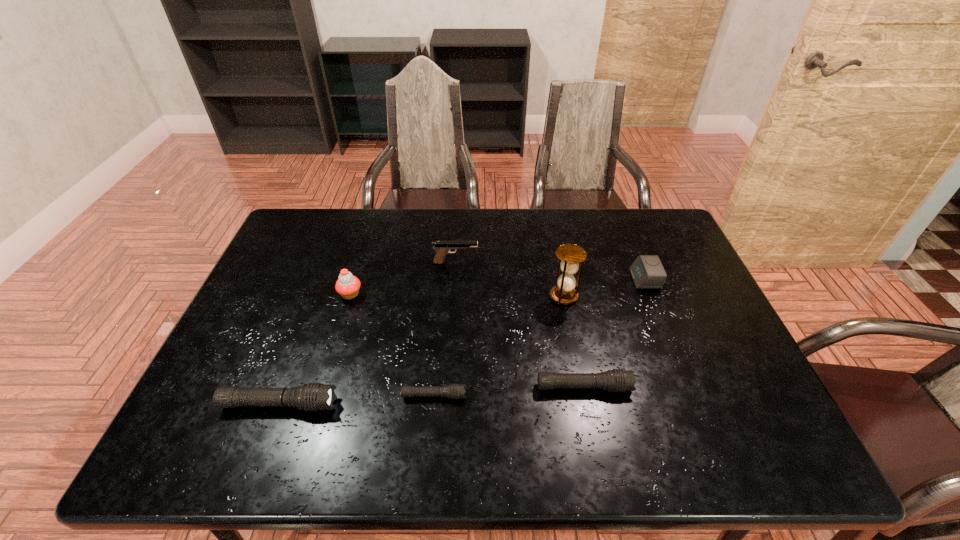
This screenshot has width=960, height=540. I want to click on the leftmost flashlight, so click(x=313, y=396).

Identify the location of the second flashlight from left to right. (454, 391).

Image resolution: width=960 pixels, height=540 pixels. I want to click on the shortest flashlight, so click(x=454, y=391).

Where is `the second tallest flashlight`? The width and height of the screenshot is (960, 540). the second tallest flashlight is located at coordinates (617, 380).

Where is `the rightmost flashlight`? The width and height of the screenshot is (960, 540). the rightmost flashlight is located at coordinates (617, 380).

The image size is (960, 540). What are the coordinates of `the farthest object` in the screenshot? It's located at point(442,248).

Where is `the rightmost object`? This screenshot has height=540, width=960. the rightmost object is located at coordinates (647, 272).

At what (x,y) coordinates should I click in order to perform the action: click on cupcake. Please return your answer as a coordinate pair (x, y). The width and height of the screenshot is (960, 540). Looking at the image, I should click on (347, 285).

Identify the location of the tallest object. This screenshot has height=540, width=960. (570, 255).

At what (x,y) coordinates should I click in order to perform the action: click on vacant area situated 0.080m at the lens end of the leftmost flashlight. Please return your answer as a coordinate pair (x, y). The width and height of the screenshot is (960, 540). Looking at the image, I should click on (371, 404).